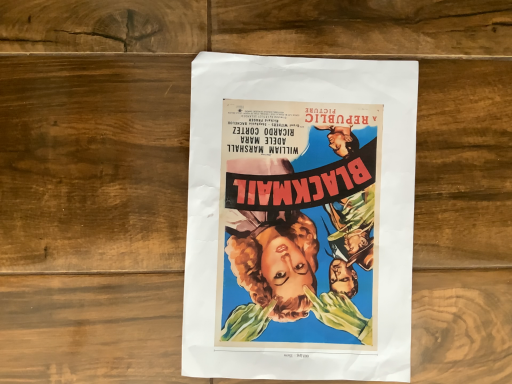
Find the location of a particular element. free space above vibrant paper poster at center (from a real-world perspective) is located at coordinates (304, 215).